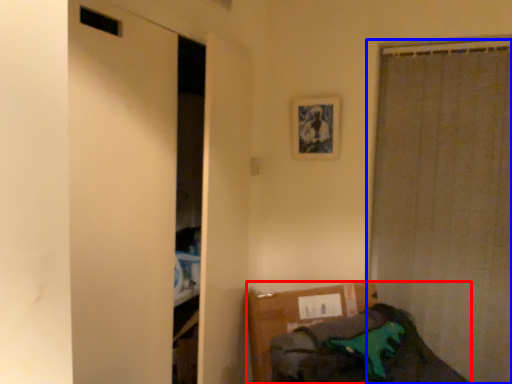
Question: Among these objects, which one is nearest to the camera, furniture (highlighted by a red box) or curtain (highlighted by a blue box)?

Choices:
 (A) furniture
 (B) curtain

Answer: (A)